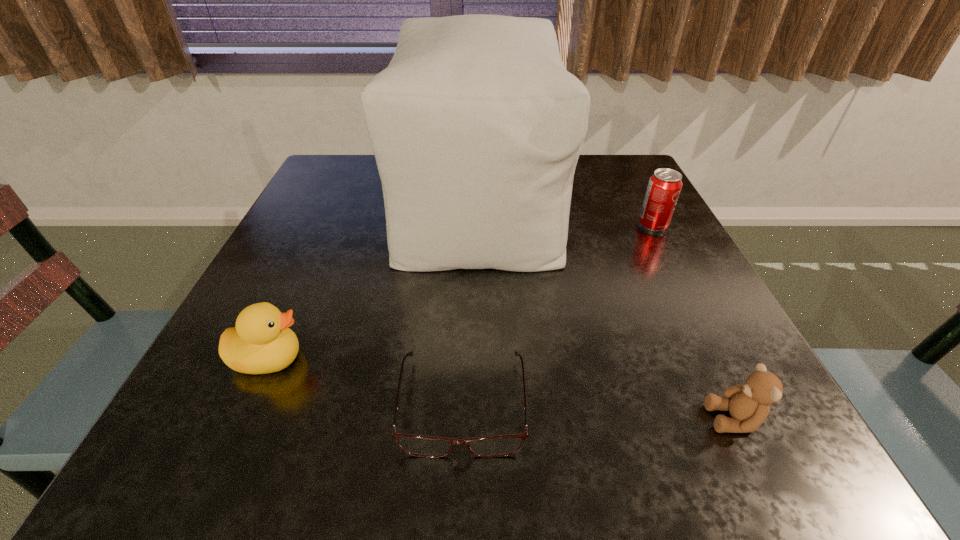
Locate an element on the screen. The height and width of the screenshot is (540, 960). vacant space at the right edge of the desktop is located at coordinates (717, 336).

The image size is (960, 540). Find the location of `vacant space at the far left corner of the desktop`. vacant space at the far left corner of the desktop is located at coordinates (362, 178).

You are a GUI agent. You are given a task and a screenshot of the screen. Output one action in this format:
    pyautogui.click(x=<x>, y=<y>)
    Task: Click on the free space at the far right corner of the desktop
    This screenshot has width=960, height=540.
    Given the screenshot: What is the action you would take?
    pyautogui.click(x=612, y=181)

Image resolution: width=960 pixels, height=540 pixels. Find the location of `free space that is in between the soda and the fourth tallest object`. free space that is in between the soda and the fourth tallest object is located at coordinates (693, 322).

Find the location of a particular element. The height and width of the screenshot is (540, 960). vacant area between the teddy bear and the tallest object is located at coordinates (606, 311).

At what (x,y) coordinates should I click in order to perform the action: click on vacant space in between the leftmost object and the fourth tallest object. Please return your answer as a coordinate pair (x, y). The width and height of the screenshot is (960, 540). Looking at the image, I should click on (501, 389).

Image resolution: width=960 pixels, height=540 pixels. I want to click on free space between the shortest object and the teddy bear, so click(x=598, y=411).

Find the location of a particular element. The width and height of the screenshot is (960, 540). unoccupied area between the second shortest object and the shortest object is located at coordinates (598, 411).

Where is `free space that is in between the cushion and the fourth tallest object`? This screenshot has width=960, height=540. free space that is in between the cushion and the fourth tallest object is located at coordinates (606, 311).

Image resolution: width=960 pixels, height=540 pixels. What are the coordinates of `vacant space that is in between the spectacles and the teddy bear` in the screenshot? It's located at (598, 411).